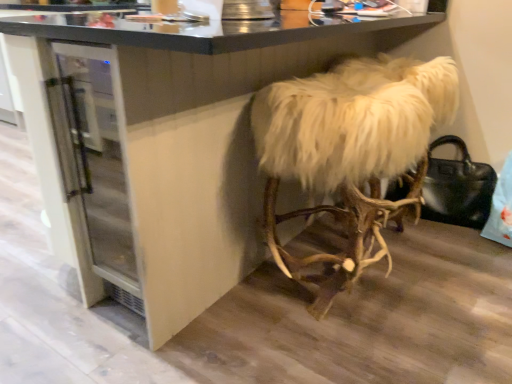
At what (x,y) coordinates should I click in order to perform the action: click on white fluffy cushion at lower right. Please return your answer as a coordinate pair (x, y). The width and height of the screenshot is (512, 384). Looking at the image, I should click on (350, 151).

This screenshot has height=384, width=512. What do you see at coordinates (350, 151) in the screenshot? I see `white fluffy cushion at lower right` at bounding box center [350, 151].

This screenshot has width=512, height=384. What are the coordinates of `white fluffy cushion at lower right` in the screenshot? It's located at (350, 151).